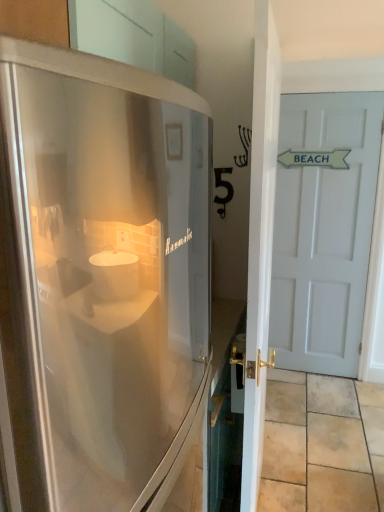
Question: Would you say stainless steel refrigerator at left is a long distance from white glossy door at right, the first door when ordered from front to back?

Choices:
 (A) yes
 (B) no

Answer: (B)

Question: Can you confirm if stainless steel refrigerator at left is bigger than white glossy door at right, the first door positioned from the left?

Choices:
 (A) no
 (B) yes

Answer: (B)

Question: Is stainless steel refrigerator at left at the right side of white glossy door at right, which appears as the second door when viewed from the right?

Choices:
 (A) yes
 (B) no

Answer: (B)

Question: Can you confirm if stainless steel refrigerator at left is shorter than white glossy door at right, the first door positioned from the left?

Choices:
 (A) no
 (B) yes

Answer: (B)

Question: Can you see stainless steel refrigerator at left touching white glossy door at right, which appears as the second door when viewed from the right?

Choices:
 (A) no
 (B) yes

Answer: (A)

Question: From the image's perspective, is stainless steel refrigerator at left located beneath white glossy door at right, the first door when ordered from front to back?

Choices:
 (A) no
 (B) yes

Answer: (B)

Question: Could you tell me if beige stone tile at lower right is turned towards white glossy door at right, the first door when ordered from front to back?

Choices:
 (A) yes
 (B) no

Answer: (B)

Question: Is beige stone tile at lower right placed right next to white glossy door at right, which is the 2th door from back to front?

Choices:
 (A) no
 (B) yes

Answer: (A)

Question: Can you confirm if beige stone tile at lower right is thinner than white glossy door at right, which appears as the second door when viewed from the right?

Choices:
 (A) yes
 (B) no

Answer: (B)

Question: Is beige stone tile at lower right turned away from white glossy door at right, the first door positioned from the left?

Choices:
 (A) no
 (B) yes

Answer: (A)

Question: Can you confirm if beige stone tile at lower right is bigger than white glossy door at right, which appears as the second door when viewed from the right?

Choices:
 (A) no
 (B) yes

Answer: (A)

Question: Does beige stone tile at lower right have a smaller size compared to white glossy door at right, which is the 2th door from back to front?

Choices:
 (A) no
 (B) yes

Answer: (B)

Question: Can you confirm if white glossy door at right, the first door when ordered from front to back, is shorter than beige stone tile at lower right?

Choices:
 (A) yes
 (B) no

Answer: (B)